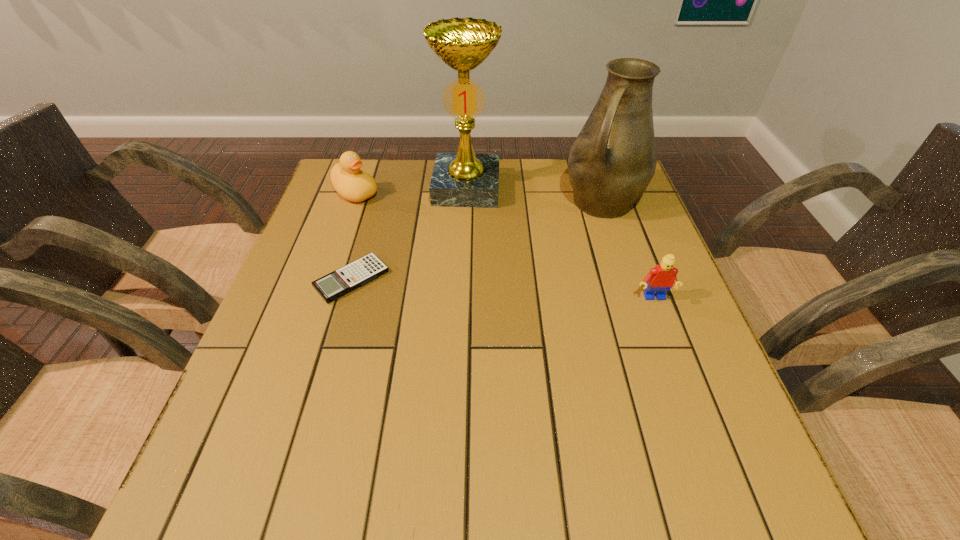
You are a GUI agent. You are given a task and a screenshot of the screen. Output one action in this format:
    pyautogui.click(x=<x>, y=<y>)
    Task: Click on the vacant space on the desktop that is between the calculator and the Lego and is positioned on the front-facing side of the award
    Image resolution: width=960 pixels, height=540 pixels.
    Given the screenshot: What is the action you would take?
    pyautogui.click(x=455, y=286)

You are a GUI agent. You are given a task and a screenshot of the screen. Output one action in this format:
    pyautogui.click(x=<x>, y=<y>)
    Task: Click on the free space on the desktop that is between the shortest object and the Lego and is positioned on the face of the duck
    The image size is (960, 540).
    Given the screenshot: What is the action you would take?
    pyautogui.click(x=496, y=289)

The height and width of the screenshot is (540, 960). In order to click on vacant space on the desktop that is between the calculator and the Lego and is positioned on the handle side of the pitcher in this screenshot , I will do `click(544, 292)`.